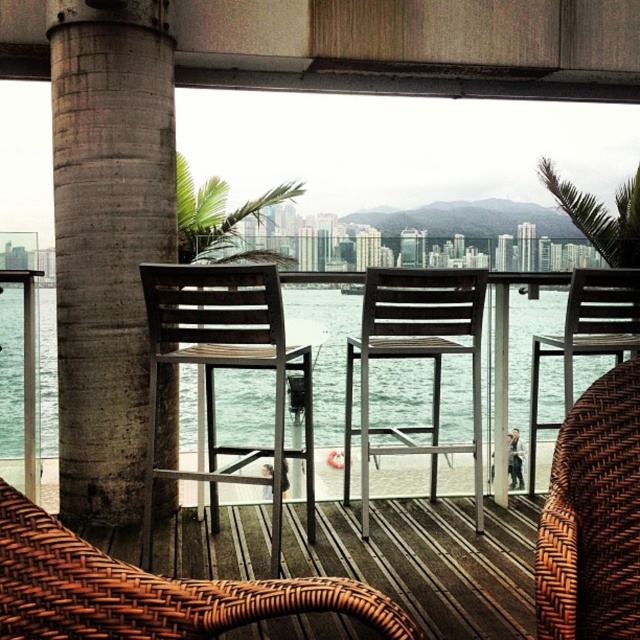
Question: Can you confirm if concrete textured pillar at left is bigger than brown woven armchair at lower left?

Choices:
 (A) no
 (B) yes

Answer: (B)

Question: Does brown woven chair at center have a lesser width compared to metallic silver chair at center?

Choices:
 (A) yes
 (B) no

Answer: (B)

Question: Is clear water at table center wider than brown woven armchair at lower right?

Choices:
 (A) yes
 (B) no

Answer: (A)

Question: Which point appears closest to the camera in this image?

Choices:
 (A) (260, 292)
 (B) (612, 330)
 (C) (362, 412)
 (D) (145, 625)

Answer: (D)

Question: Considering the real-world distances, which object is farthest from the metallic silver chair at center?

Choices:
 (A) woven brown armchair at right
 (B) clear water at table center

Answer: (A)

Question: Which point appears farthest from the camera in this image?

Choices:
 (A) (536, 312)
 (B) (632, 280)

Answer: (A)